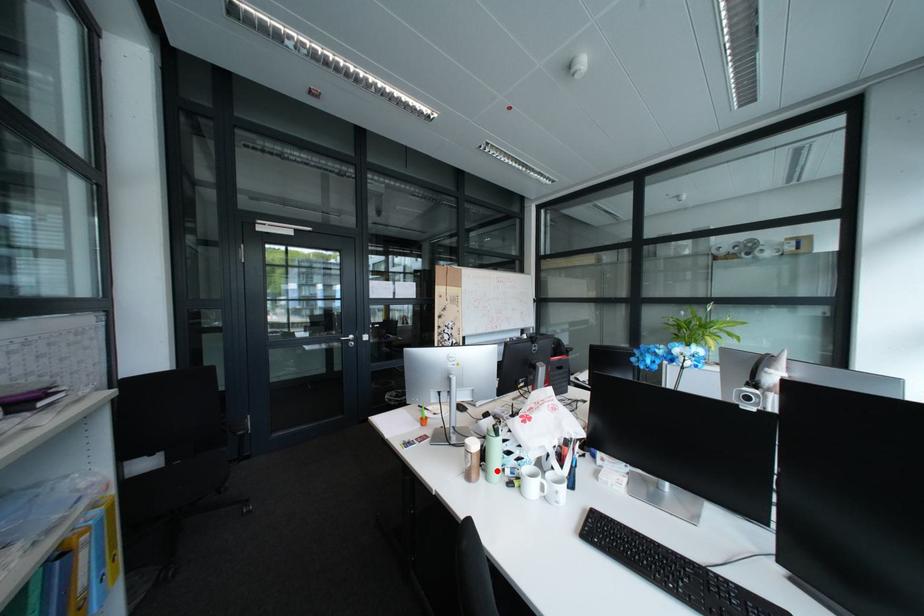
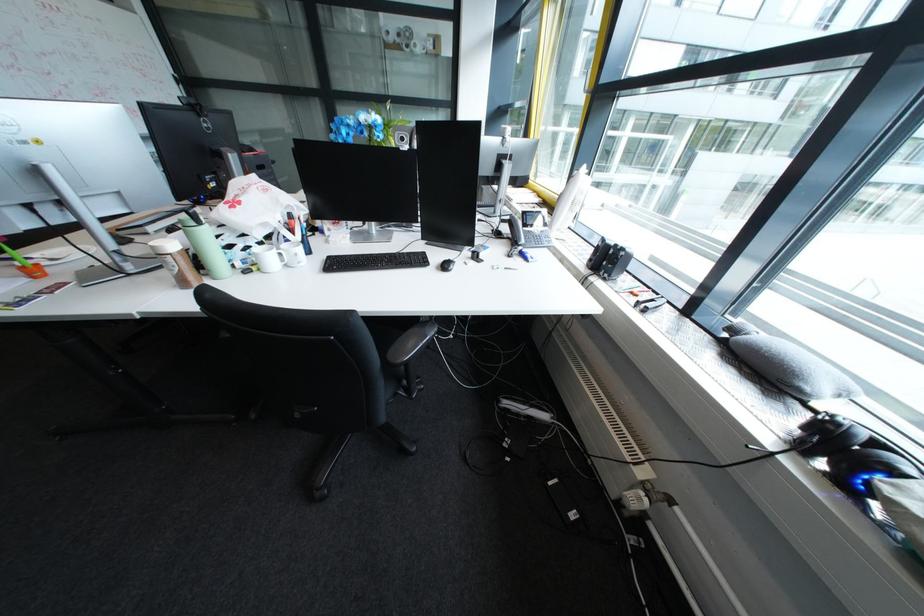
Question: I am providing you with two images of the same scene from different viewpoints. In image1, a red point is highlighted. Considering the same 3D point in image2, which of the following is correct?

Choices:
 (A) It is closer
 (B) It is farther

Answer: (A)